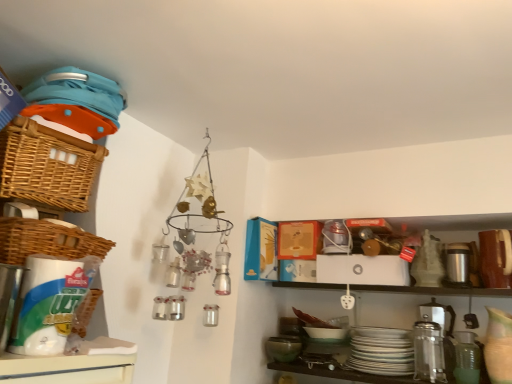
Question: Looking at the image, does woven brown basket at upper left, the 1th basket when ordered from top to bottom, seem bigger or smaller compared to green matte mixing bowl at lower center?

Choices:
 (A) small
 (B) big

Answer: (B)

Question: Is woven brown basket at upper left, marked as the second basket in a bottom-to-top arrangement, in front of or behind green matte mixing bowl at lower center in the image?

Choices:
 (A) front
 (B) behind

Answer: (A)

Question: Based on their relative distances, which object is farther from the woven brown basket at left, arranged as the 1th basket when ordered from the bottom?

Choices:
 (A) silver metallic thermos at right
 (B) woven brown basket at upper left, the 1th basket when ordered from top to bottom
 (C) green matte mixing bowl at lower center

Answer: (A)

Question: Based on their relative distances, which object is farther from the woven brown basket at upper left, marked as the second basket in a bottom-to-top arrangement?

Choices:
 (A) woven brown basket at left, arranged as the 1th basket when ordered from the bottom
 (B) silver metallic thermos at right
 (C) green matte mixing bowl at lower center

Answer: (B)